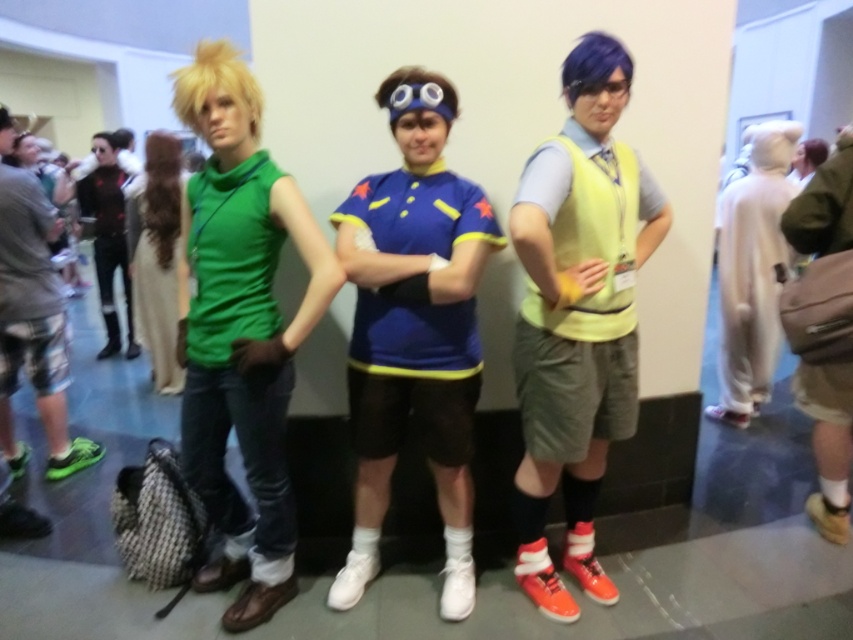
Question: Can you confirm if blue jersey at center is bigger than matte green turtleneck at center?

Choices:
 (A) yes
 (B) no

Answer: (B)

Question: Is green matte turtleneck at left to the right of white plush hoodie at right from the viewer's perspective?

Choices:
 (A) yes
 (B) no

Answer: (B)

Question: Which of the following is the closest to the observer?

Choices:
 (A) (198, 577)
 (B) (457, 198)
 (C) (717, 276)

Answer: (B)

Question: Which point is farther to the camera?

Choices:
 (A) green matte sneakers at left
 (B) yellow fabric vest at center

Answer: (A)

Question: Can you confirm if green matte sneakers at left is positioned below matte green turtleneck at center?

Choices:
 (A) no
 (B) yes

Answer: (B)

Question: Which object is the closest to the brushed metal backpack at left?

Choices:
 (A) yellow fabric vest at center
 (B) white plush hoodie at right

Answer: (A)